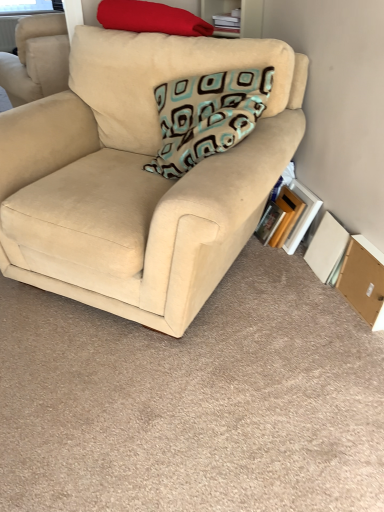
Question: Does stacked books at upper center have a smaller size compared to white cardboard book at lower right, the third paperback book in the left-to-right sequence?

Choices:
 (A) no
 (B) yes

Answer: (A)

Question: Does stacked books at upper center turn towards white cardboard book at lower right, the first paperback book in the right-to-left sequence?

Choices:
 (A) no
 (B) yes

Answer: (A)

Question: Does stacked books at upper center have a lesser height compared to white cardboard book at lower right, the third paperback book in the left-to-right sequence?

Choices:
 (A) yes
 (B) no

Answer: (A)

Question: Considering the relative sizes of stacked books at upper center and white cardboard book at lower right, the third paperback book in the left-to-right sequence, in the image provided, is stacked books at upper center taller than white cardboard book at lower right, the third paperback book in the left-to-right sequence,?

Choices:
 (A) no
 (B) yes

Answer: (A)

Question: Is stacked books at upper center surrounding white cardboard book at lower right, the first paperback book in the right-to-left sequence?

Choices:
 (A) yes
 (B) no

Answer: (B)

Question: In terms of width, does stacked books at upper center look wider or thinner when compared to white cardboard book at lower right, the third paperback book in the left-to-right sequence?

Choices:
 (A) thin
 (B) wide

Answer: (B)

Question: Looking at the image, does stacked books at upper center seem bigger or smaller compared to white cardboard book at lower right, the first paperback book in the right-to-left sequence?

Choices:
 (A) big
 (B) small

Answer: (A)

Question: In the image, is stacked books at upper center on the left side or the right side of white cardboard book at lower right, the third paperback book in the left-to-right sequence?

Choices:
 (A) left
 (B) right

Answer: (A)

Question: Choose the correct answer: Is stacked books at upper center inside white cardboard book at lower right, the third paperback book in the left-to-right sequence, or outside it?

Choices:
 (A) inside
 (B) outside

Answer: (B)

Question: From a real-world perspective, is beige fabric couch at center positioned above or below matte red pillow at upper left, the 1th pillow positioned from the top?

Choices:
 (A) above
 (B) below

Answer: (B)

Question: Based on their positions, is beige fabric couch at center located to the left or right of matte red pillow at upper left, the 2th pillow when ordered from bottom to top?

Choices:
 (A) left
 (B) right

Answer: (A)

Question: From the image's perspective, is beige fabric couch at center positioned above or below matte red pillow at upper left, the 1th pillow positioned from the top?

Choices:
 (A) below
 (B) above

Answer: (A)

Question: Considering the positions of beige fabric couch at center and matte red pillow at upper left, the 2th pillow when ordered from bottom to top, in the image, is beige fabric couch at center wider or thinner than matte red pillow at upper left, the 2th pillow when ordered from bottom to top,?

Choices:
 (A) thin
 (B) wide

Answer: (B)

Question: Considering the relative positions of hardcover book at lower right, the 2th paperback book positioned from the right, and brown cardboard box at lower right in the image provided, is hardcover book at lower right, the 2th paperback book positioned from the right, to the left or to the right of brown cardboard box at lower right?

Choices:
 (A) right
 (B) left

Answer: (B)

Question: In the image, is hardcover book at lower right, which is the second paperback book from left to right, positioned in front of or behind brown cardboard box at lower right?

Choices:
 (A) behind
 (B) front

Answer: (A)